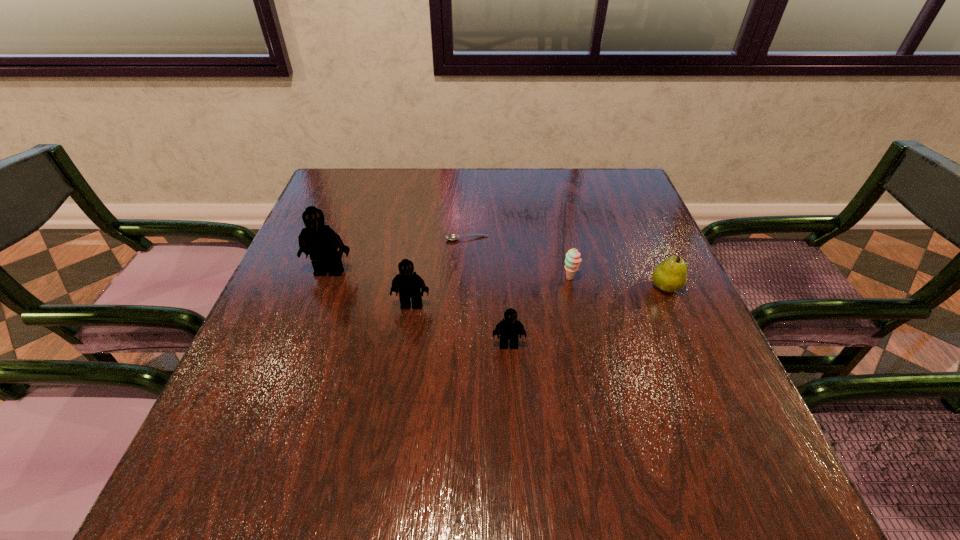
This screenshot has height=540, width=960. I want to click on the farthest Lego, so click(x=321, y=242).

You are a GUI agent. You are given a task and a screenshot of the screen. Output one action in this format:
    pyautogui.click(x=<x>, y=<y>)
    Task: Click on the leftmost object
    Image resolution: width=960 pixels, height=540 pixels.
    Given the screenshot: What is the action you would take?
    pyautogui.click(x=321, y=242)

The width and height of the screenshot is (960, 540). I want to click on the second object from left to right, so click(x=407, y=283).

Where is `the second farthest Lego`? This screenshot has height=540, width=960. the second farthest Lego is located at coordinates (407, 283).

Where is `the nearest object`? the nearest object is located at coordinates (510, 328).

Locate an element on the screen. the nearest Lego is located at coordinates (510, 328).

Where is `the second object from right to left`? the second object from right to left is located at coordinates (572, 261).

Locate an element on the screen. The width and height of the screenshot is (960, 540). the fourth object from right to left is located at coordinates (452, 236).

Locate an element on the screen. This screenshot has width=960, height=540. the shortest object is located at coordinates (452, 236).

Find the location of a particular element. The height and width of the screenshot is (540, 960). pear is located at coordinates click(x=670, y=275).